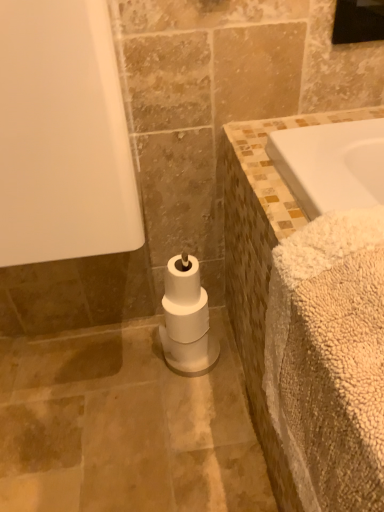
Question: Does black glass mirror at upper right have a greater height compared to white matte toilet paper at center?

Choices:
 (A) no
 (B) yes

Answer: (A)

Question: From the image's perspective, is black glass mirror at upper right on white matte toilet paper at center?

Choices:
 (A) yes
 (B) no

Answer: (A)

Question: Can you confirm if black glass mirror at upper right is wider than white matte toilet paper at center?

Choices:
 (A) yes
 (B) no

Answer: (B)

Question: Does black glass mirror at upper right have a lesser width compared to white matte toilet paper at center?

Choices:
 (A) no
 (B) yes

Answer: (B)

Question: From a real-world perspective, is black glass mirror at upper right located beneath white matte toilet paper at center?

Choices:
 (A) no
 (B) yes

Answer: (A)

Question: From the image's perspective, is black glass mirror at upper right located above or below white matte toilet paper at center?

Choices:
 (A) below
 (B) above

Answer: (B)

Question: Considering the positions of black glass mirror at upper right and white matte toilet paper at center in the image, is black glass mirror at upper right taller or shorter than white matte toilet paper at center?

Choices:
 (A) short
 (B) tall

Answer: (A)

Question: Looking at the image, does black glass mirror at upper right seem bigger or smaller compared to white matte toilet paper at center?

Choices:
 (A) small
 (B) big

Answer: (A)

Question: Is point (370, 4) positioned closer to the camera than point (173, 318)?

Choices:
 (A) closer
 (B) farther

Answer: (A)

Question: Is beige fluffy bath towel at right spatially inside white matte toilet paper at center, or outside of it?

Choices:
 (A) outside
 (B) inside

Answer: (A)

Question: From a real-world perspective, is beige fluffy bath towel at right physically located above or below white matte toilet paper at center?

Choices:
 (A) above
 (B) below

Answer: (A)

Question: Considering the positions of beige fluffy bath towel at right and white matte toilet paper at center in the image, is beige fluffy bath towel at right wider or thinner than white matte toilet paper at center?

Choices:
 (A) wide
 (B) thin

Answer: (A)

Question: In terms of height, does beige fluffy bath towel at right look taller or shorter compared to white matte toilet paper at center?

Choices:
 (A) short
 (B) tall

Answer: (B)

Question: Is black glass mirror at upper right taller or shorter than beige fluffy bath towel at right?

Choices:
 (A) tall
 (B) short

Answer: (B)

Question: From a real-world perspective, is black glass mirror at upper right positioned above or below beige fluffy bath towel at right?

Choices:
 (A) below
 (B) above

Answer: (B)